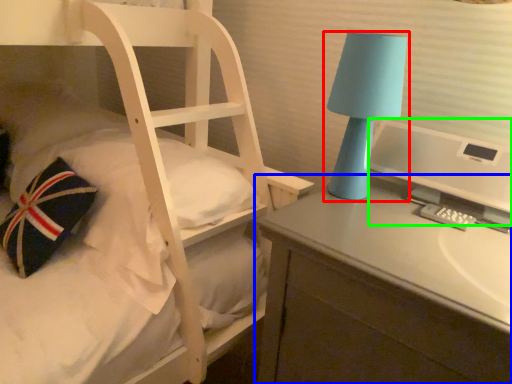
Question: Which object is positioned farthest from lamp (highlighted by a red box)? Select from desk (highlighted by a blue box) and computer monitor (highlighted by a green box).

Choices:
 (A) desk
 (B) computer monitor

Answer: (A)